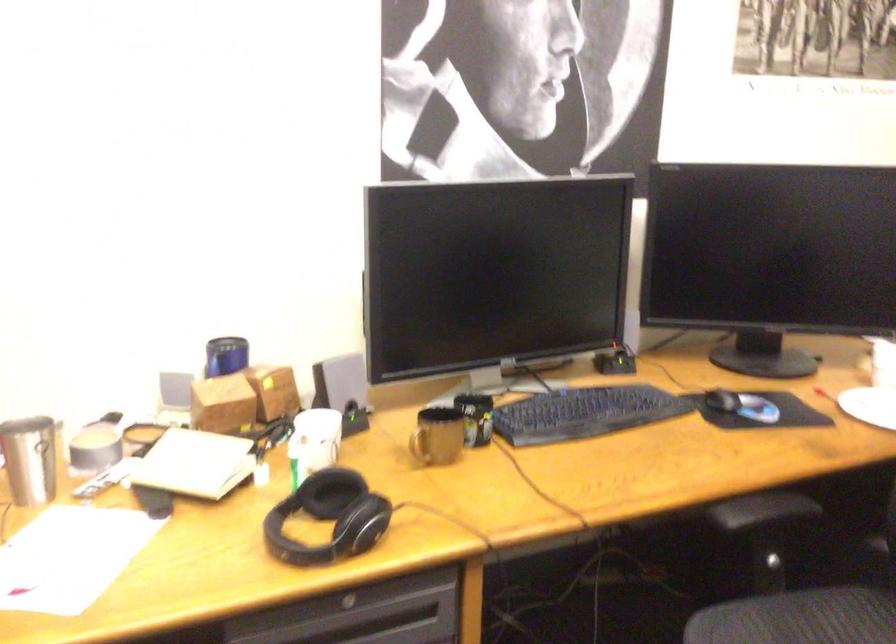
Image resolution: width=896 pixels, height=644 pixels. What do you see at coordinates (419, 442) in the screenshot?
I see `a black mug handle` at bounding box center [419, 442].